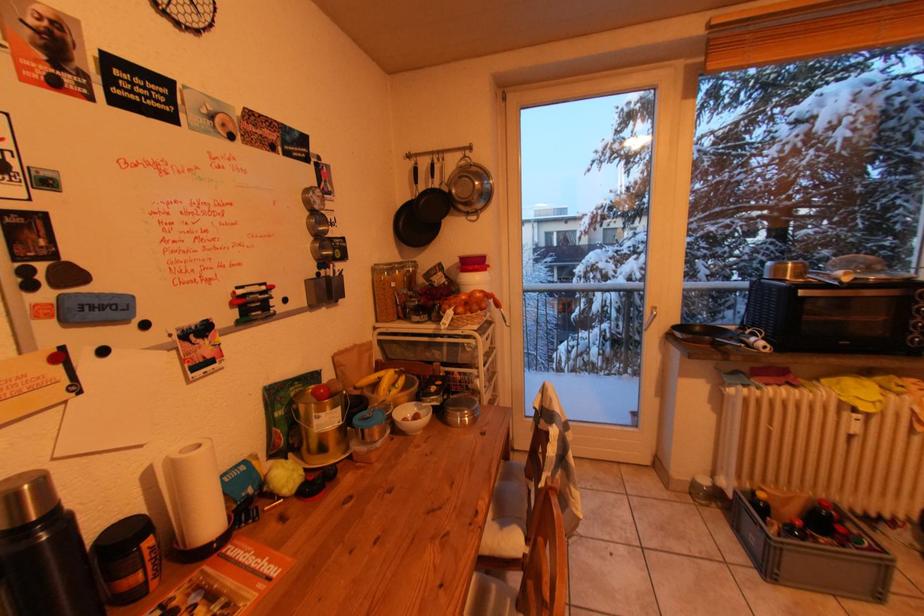
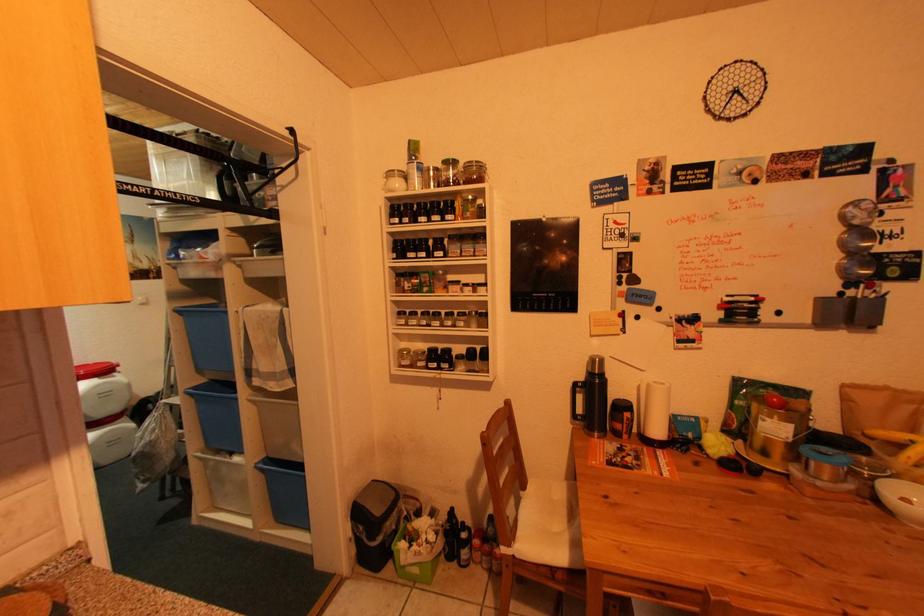
Question: The first image is from the beginning of the video and the second image is from the end. How did the camera likely rotate when shooting the video?

Choices:
 (A) Left
 (B) Right
 (C) Up
 (D) Down

Answer: (A)